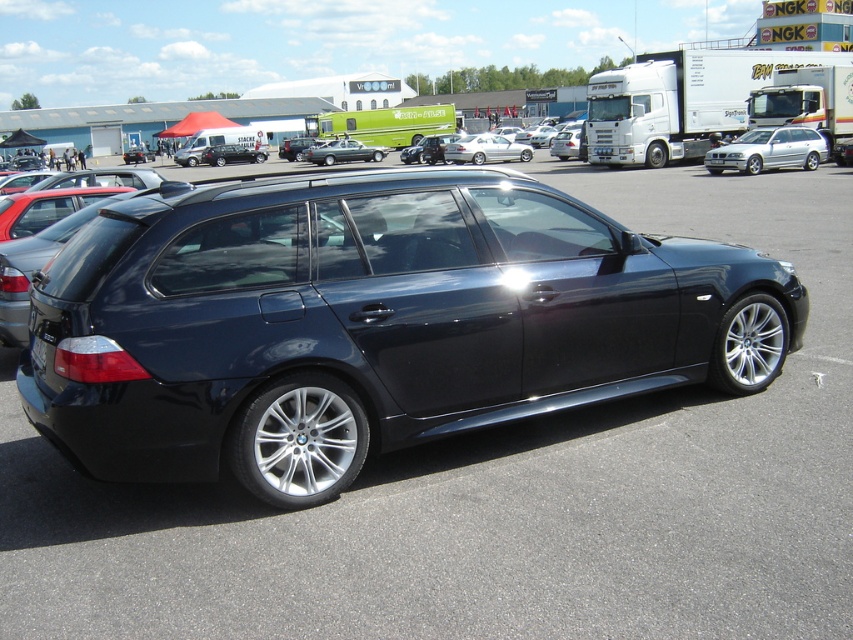
Does satin silver wagon at center have a greater width compared to black plastic license plate at rear?

Correct, the width of satin silver wagon at center exceeds that of black plastic license plate at rear.

Does satin silver wagon at center appear on the left side of black plastic license plate at rear?

Indeed, satin silver wagon at center is positioned on the left side of black plastic license plate at rear.

The image size is (853, 640). What are the coordinates of `satin silver wagon at center` in the screenshot? It's located at (341, 152).

Is point (763, 145) positioned behind point (518, 148)?

No, it is not.

Who is positioned more to the right, silver metallic wagon at right or silver metallic sedan at center?

Positioned to the right is silver metallic wagon at right.

Who is more forward, (723, 161) or (448, 157)?

Point (723, 161)

Where is `silver metallic wagon at right`? silver metallic wagon at right is located at coordinates pyautogui.click(x=769, y=150).

Does point (518, 154) come farther from viewer compared to point (39, 360)?

Yes, it is.

Is silver metallic sedan at center thinner than black plastic license plate at rear?

In fact, silver metallic sedan at center might be wider than black plastic license plate at rear.

Who is more forward, (459,161) or (38,342)?

Point (38,342) is more forward.

At what (x,y) coordinates should I click in order to perform the action: click on silver metallic sedan at center. Please return your answer as a coordinate pair (x, y). Looking at the image, I should click on (485, 148).